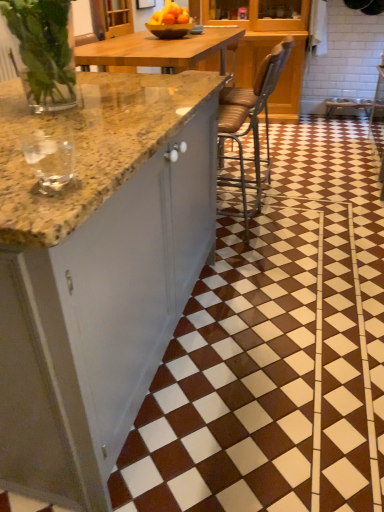
Question: Does brown leather chair at center appear on the left side of clear glass wine glass at left?

Choices:
 (A) yes
 (B) no

Answer: (B)

Question: Is brown leather chair at center far away from clear glass wine glass at left?

Choices:
 (A) yes
 (B) no

Answer: (A)

Question: Is brown leather chair at center beside clear glass wine glass at left?

Choices:
 (A) yes
 (B) no

Answer: (B)

Question: Is brown leather chair at center in front of clear glass wine glass at left?

Choices:
 (A) no
 (B) yes

Answer: (A)

Question: Could you tell me if brown leather chair at center is facing clear glass wine glass at left?

Choices:
 (A) yes
 (B) no

Answer: (B)

Question: From a real-world perspective, relative to brown glossy tile at center, is clear glass wine glass at left vertically above or below?

Choices:
 (A) above
 (B) below

Answer: (A)

Question: Does point (48, 181) appear closer or farther from the camera than point (206, 502)?

Choices:
 (A) farther
 (B) closer

Answer: (B)

Question: Would you say clear glass wine glass at left is to the left or to the right of brown glossy tile at center in the picture?

Choices:
 (A) left
 (B) right

Answer: (A)

Question: Considering the positions of clear glass wine glass at left and brown glossy tile at center in the image, is clear glass wine glass at left bigger or smaller than brown glossy tile at center?

Choices:
 (A) small
 (B) big

Answer: (A)

Question: From the image's perspective, is clear glass wine glass at left above or below brown leather chair at center?

Choices:
 (A) below
 (B) above

Answer: (A)

Question: Is point (23, 141) positioned closer to the camera than point (251, 123)?

Choices:
 (A) closer
 (B) farther

Answer: (A)

Question: Is clear glass wine glass at left taller or shorter than brown leather chair at center?

Choices:
 (A) tall
 (B) short

Answer: (B)

Question: Would you say clear glass wine glass at left is inside or outside brown leather chair at center?

Choices:
 (A) inside
 (B) outside

Answer: (B)

Question: Considering their positions, is brown leather chair at center located in front of or behind clear glass wine glass at left?

Choices:
 (A) front
 (B) behind

Answer: (B)

Question: From the image's perspective, is brown leather chair at center positioned above or below clear glass wine glass at left?

Choices:
 (A) above
 (B) below

Answer: (A)